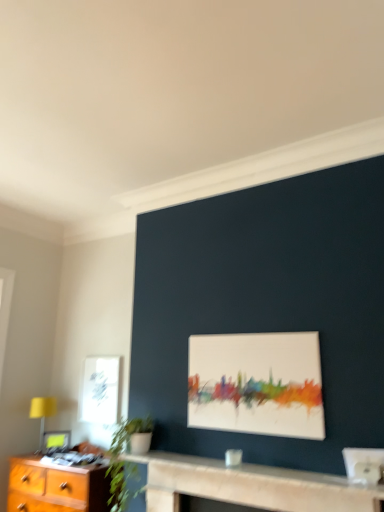
Find the location of a particular element. The width and height of the screenshot is (384, 512). vacant space in white matte painting at center, positioned as the 1th picture frame in front-to-back order (from a real-world perspective) is located at coordinates (269, 468).